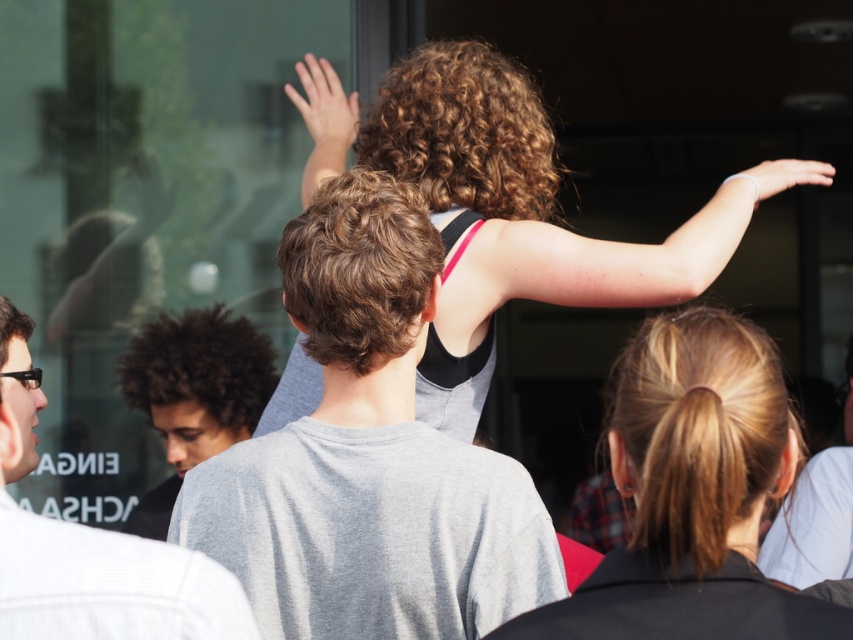
You are standing at the entrance of the glass door at upper left marked by point (141, 202). You want to join the group of people who are behind the glass door. Which direction should you move to reach them?

The transparent glass door at upper left marked by point (141, 202) is the entrance, so you should move forward through the door to reach the group of people behind it.

You are standing at the glass door and see the point marked at coordinates (x=512, y=216). What is the significance of this point in relation to the curly hair person at center?

The point marked at coordinates (x=512, y=216) marks the location of the curly hair person at center.